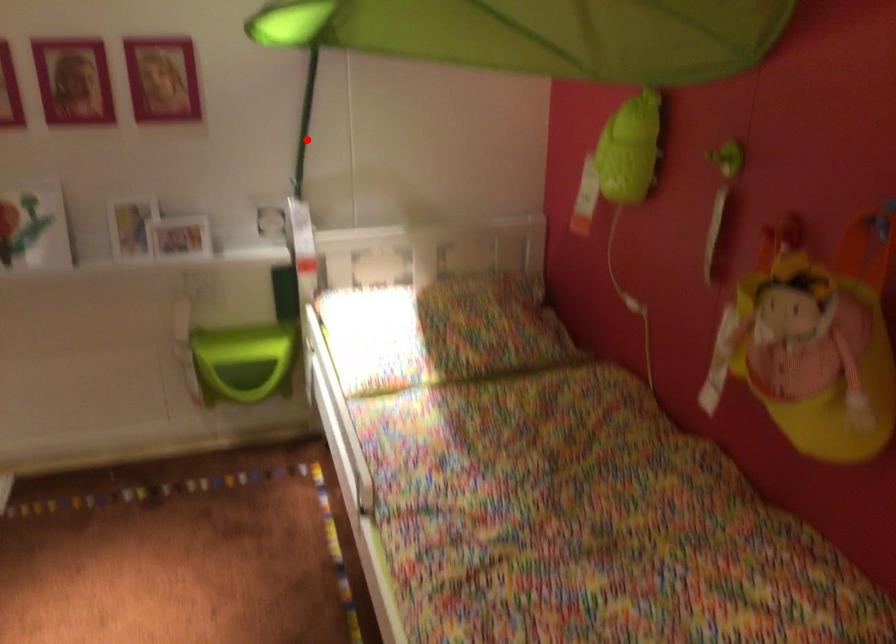
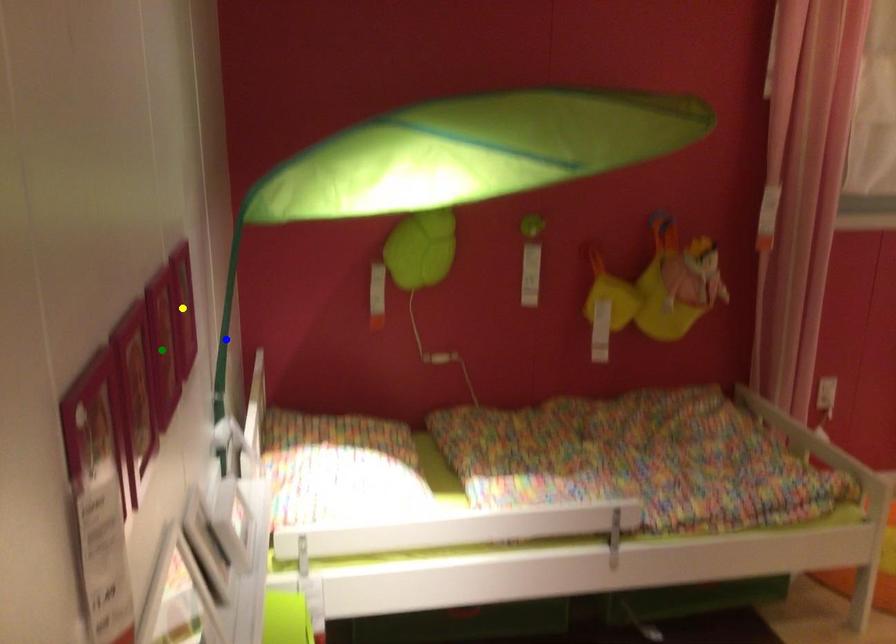
Question: I am providing you with two images of the same scene from different viewpoints. A red point is marked on the first image. You are given multiple points on the second image. In image 2, which mark is for the same physical point as the one in image 1?

Choices:
 (A) green point
 (B) yellow point
 (C) blue point

Answer: (C)